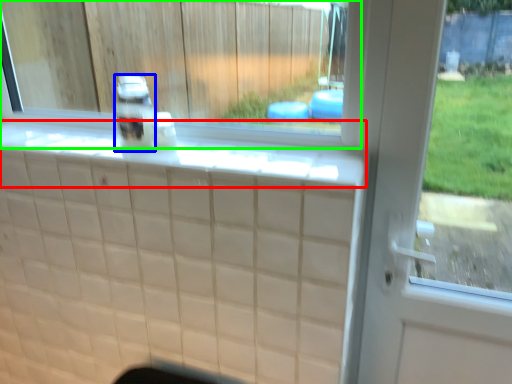
Question: Which object is positioned farthest from ledge (highlighted by a red box)? Select from bottle (highlighted by a blue box) and window (highlighted by a green box).

Choices:
 (A) bottle
 (B) window

Answer: (B)